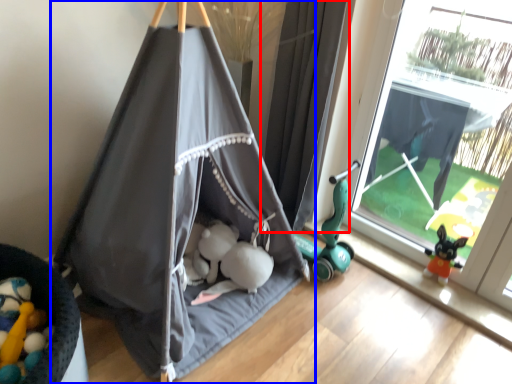
Question: Among these objects, which one is farthest to the camera, curtain (highlighted by a red box) or tent (highlighted by a blue box)?

Choices:
 (A) curtain
 (B) tent

Answer: (A)